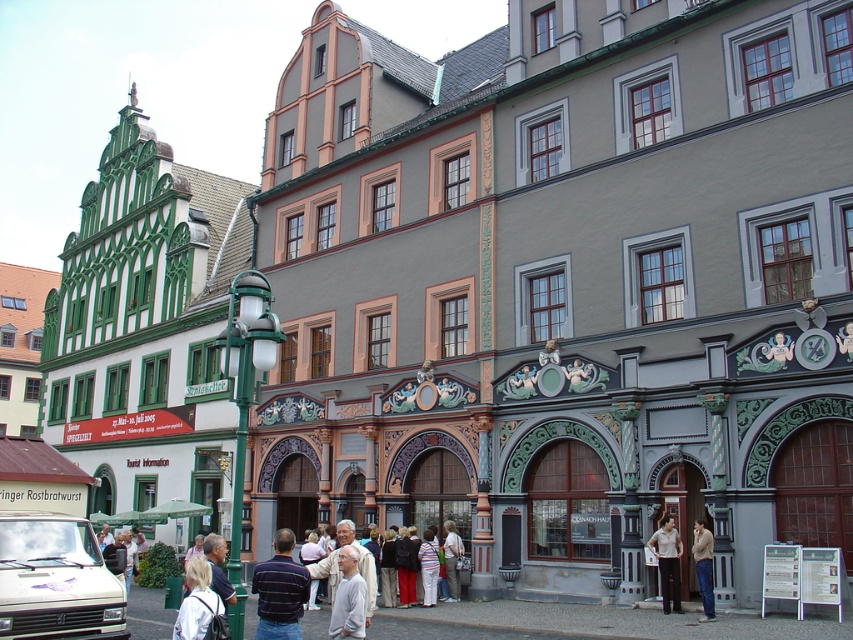
Question: Which object is the farthest from the white matte shirt at lower center?

Choices:
 (A) light beige fabric jacket at center
 (B) white matte van at lower left

Answer: (A)

Question: Which of the following is the closest to the observer?

Choices:
 (A) (705, 600)
 (B) (339, 602)
 (C) (296, 634)
 (D) (659, 534)

Answer: (C)

Question: Is striped cotton shirt at center closer to the viewer compared to denim jeans at lower right?

Choices:
 (A) yes
 (B) no

Answer: (A)

Question: Can you confirm if striped cotton shirt at center is positioned above denim jeans at lower right?

Choices:
 (A) yes
 (B) no

Answer: (B)

Question: Can you confirm if light blue denim jacket at lower left is bigger than denim jeans at lower right?

Choices:
 (A) no
 (B) yes

Answer: (B)

Question: Considering the real-world distances, which object is farthest from the white matte shirt at lower center?

Choices:
 (A) light blue denim jacket at lower left
 (B) light brown leather pants at lower center
 (C) striped cotton shirt at center

Answer: (B)